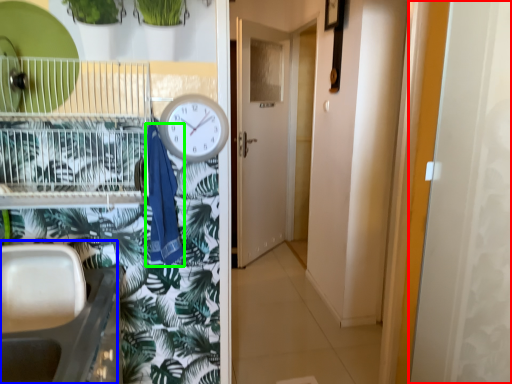
Question: Which object is positioned closest to screen door (highlighted by a red box)? Select from sink (highlighted by a blue box) and laundry (highlighted by a green box).

Choices:
 (A) sink
 (B) laundry

Answer: (B)